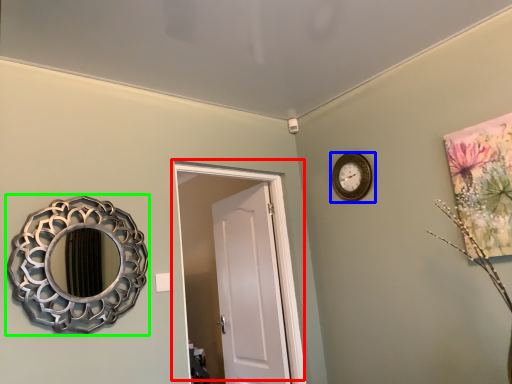
Question: Which object is the closest to the door (highlighted by a red box)? Choose among these: wall clock (highlighted by a blue box) or mirror (highlighted by a green box).

Choices:
 (A) wall clock
 (B) mirror

Answer: (A)